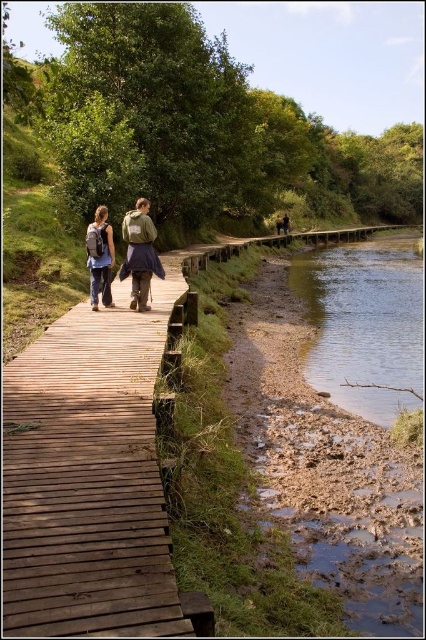
You are a hiker who wants to grab your backpack before continuing along the boardwalk. Which backpack should you reach for first, the matte brown backpack at center or the brown leather backpack at center?

The matte brown backpack at center is closer to you than the brown leather backpack at center, so you should reach for the matte brown backpack at center first.

You are a hiker who needs to cross the river. You see the clear water at lower right and the brown leather backpack at center. Which one is a better option to step on to cross the river?

The clear water at lower right is larger in size than the brown leather backpack at center, so stepping on the clear water at lower right would provide a more stable footing for crossing the river.

You are standing at the point with coordinates (89, 476) in the image. What object are you standing on?

You are standing on the brown wooden boardwalk at center.